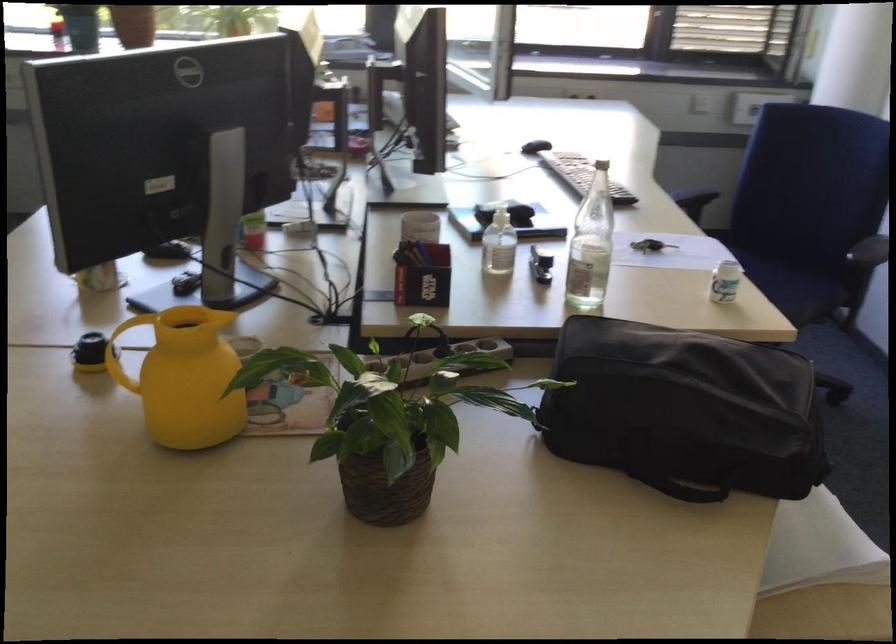
The image size is (896, 644). What do you see at coordinates (698, 194) in the screenshot?
I see `the chair armrest` at bounding box center [698, 194].